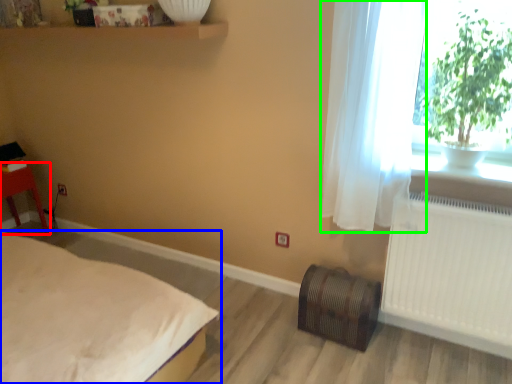
Question: Which is farther away from furniture (highlighted by a red box)? bed (highlighted by a blue box) or curtain (highlighted by a green box)?

Choices:
 (A) bed
 (B) curtain

Answer: (B)